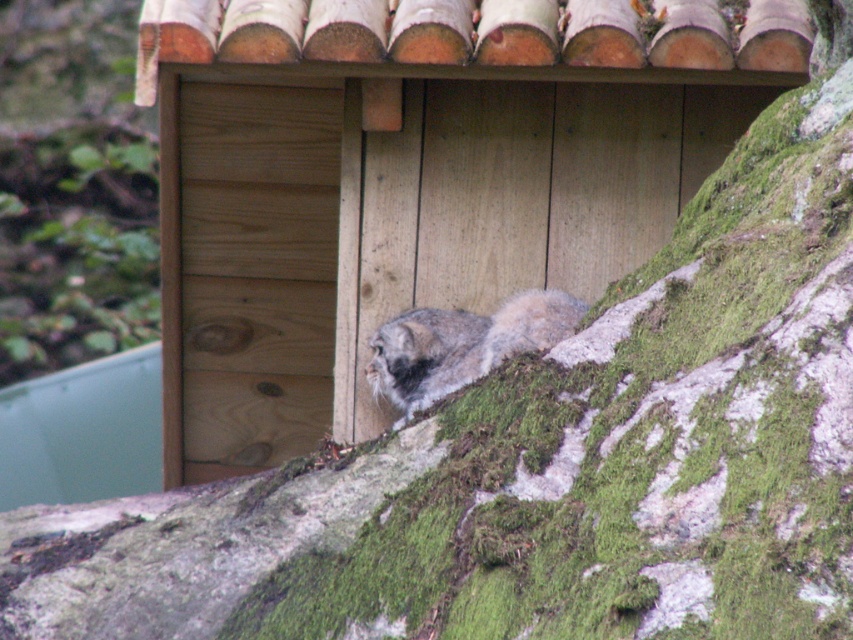
Question: Among these objects, which one is farthest from the camera?

Choices:
 (A) wooden cabin at center
 (B) fuzzy gray cat at center

Answer: (B)

Question: Can you confirm if wooden cabin at center is positioned to the right of fuzzy gray cat at center?

Choices:
 (A) yes
 (B) no

Answer: (A)

Question: Is wooden cabin at center to the right of fuzzy gray cat at center from the viewer's perspective?

Choices:
 (A) no
 (B) yes

Answer: (B)

Question: Which point is closer to the camera taking this photo?

Choices:
 (A) (227, 188)
 (B) (421, 371)

Answer: (B)

Question: Does wooden cabin at center have a greater width compared to fuzzy gray cat at center?

Choices:
 (A) no
 (B) yes

Answer: (B)